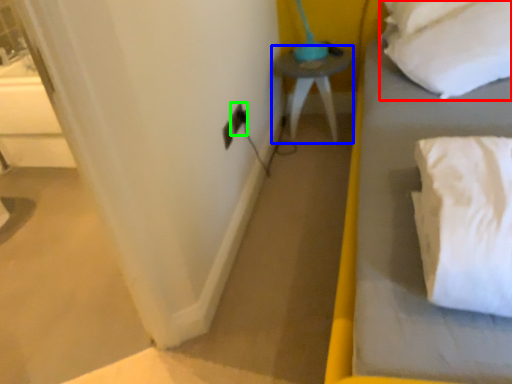
Question: Which object is positioned closest to pillow (highlighted by a red box)? Select from furniture (highlighted by a blue box) and electric outlet (highlighted by a green box).

Choices:
 (A) furniture
 (B) electric outlet

Answer: (A)